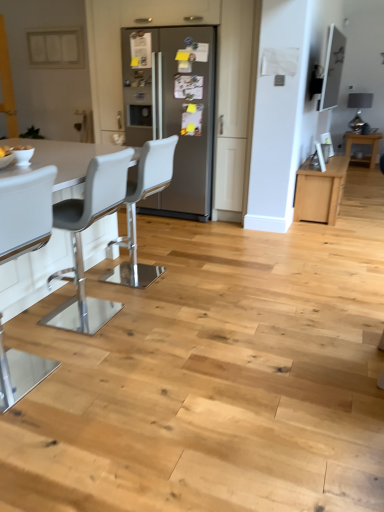
Question: Considering the relative sizes of light brown wood table at right and white leather bar stool at left, the second chair viewed from the back, in the image provided, is light brown wood table at right shorter than white leather bar stool at left, the second chair viewed from the back,?

Choices:
 (A) yes
 (B) no

Answer: (A)

Question: From the image's perspective, is light brown wood table at right beneath white leather bar stool at left, which is the 2th chair from front to back?

Choices:
 (A) no
 (B) yes

Answer: (A)

Question: Does light brown wood table at right have a greater width compared to white leather bar stool at left, which is the 2th chair from front to back?

Choices:
 (A) yes
 (B) no

Answer: (A)

Question: From a real-world perspective, is light brown wood table at right on white leather bar stool at left, which is the 2th chair from front to back?

Choices:
 (A) yes
 (B) no

Answer: (B)

Question: Is light brown wood table at right positioned behind white leather bar stool at left, which is the 2th chair from front to back?

Choices:
 (A) yes
 (B) no

Answer: (A)

Question: Is light brown wood table at right in front of white leather bar stool at left, the second chair viewed from the back?

Choices:
 (A) no
 (B) yes

Answer: (A)

Question: Can you confirm if satin silver refrigerator at center is positioned to the left of light brown wood table at right?

Choices:
 (A) no
 (B) yes

Answer: (B)

Question: From the image's perspective, does satin silver refrigerator at center appear lower than light brown wood table at right?

Choices:
 (A) no
 (B) yes

Answer: (B)

Question: Considering the relative sizes of satin silver refrigerator at center and light brown wood table at right in the image provided, is satin silver refrigerator at center taller than light brown wood table at right?

Choices:
 (A) yes
 (B) no

Answer: (A)

Question: Does satin silver refrigerator at center have a lesser height compared to light brown wood table at right?

Choices:
 (A) no
 (B) yes

Answer: (A)

Question: Does satin silver refrigerator at center have a lesser width compared to light brown wood table at right?

Choices:
 (A) no
 (B) yes

Answer: (A)

Question: Is satin silver refrigerator at center surrounding light brown wood table at right?

Choices:
 (A) no
 (B) yes

Answer: (A)

Question: Considering the relative positions of white plastic chair at left, arranged as the 1th chair when viewed from the front, and white plastic chair at center, marked as the first chair in a back-to-front arrangement, in the image provided, is white plastic chair at left, arranged as the 1th chair when viewed from the front, behind white plastic chair at center, marked as the first chair in a back-to-front arrangement,?

Choices:
 (A) no
 (B) yes

Answer: (A)